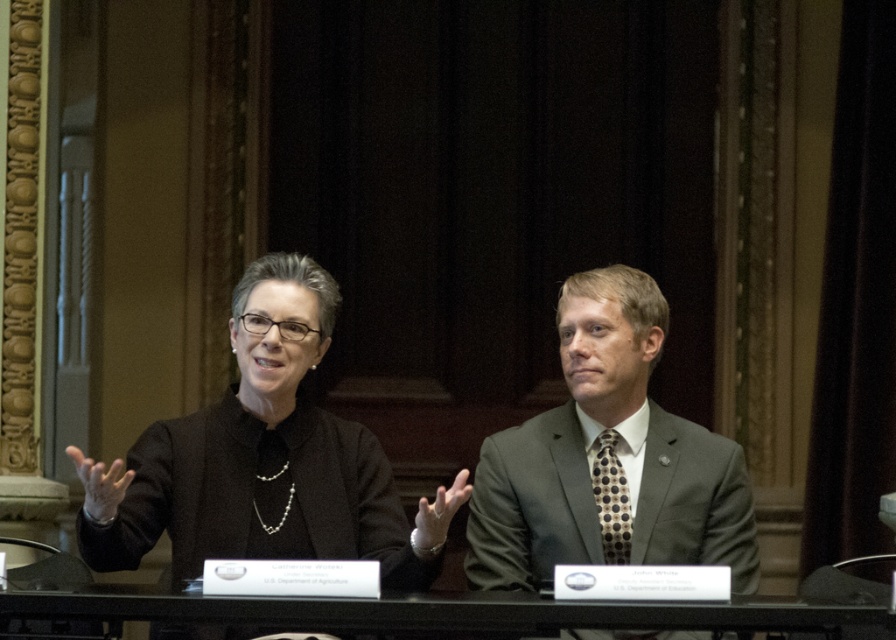
You are organizing a meeting and need to place a nameplate between the black matte blazer at center and the black glass table at center. Which object should the nameplate be placed closer to if it needs to be on the left side of the table?

The nameplate should be placed closer to the black matte blazer at center because it is already to the left of the black glass table at center, so positioning it near the blazer would place it on the left side of the table.

You are standing at the origin point in the image. Which of the two points, point [507,488] or point [4,611], is located behind the other?

Point [507,488] is behind point [4,611].